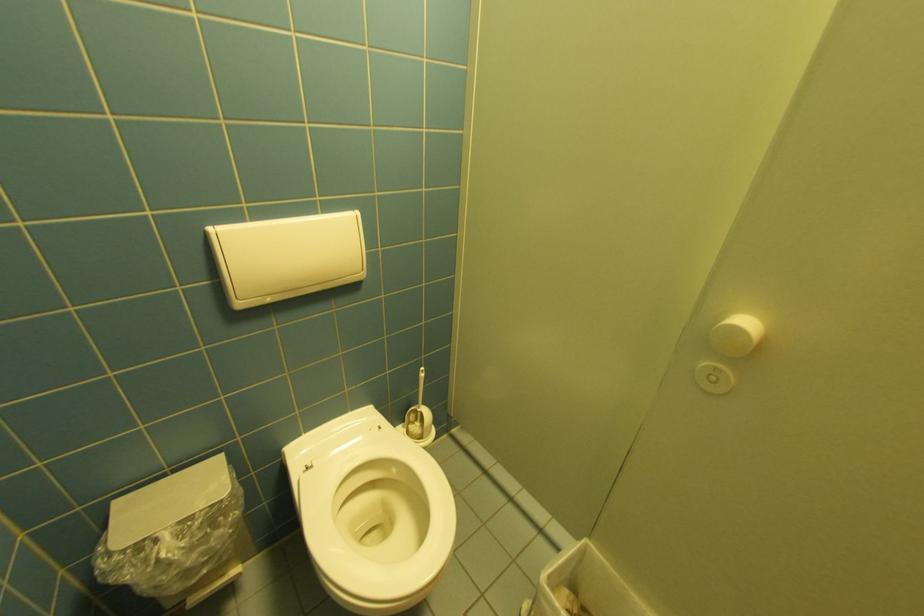
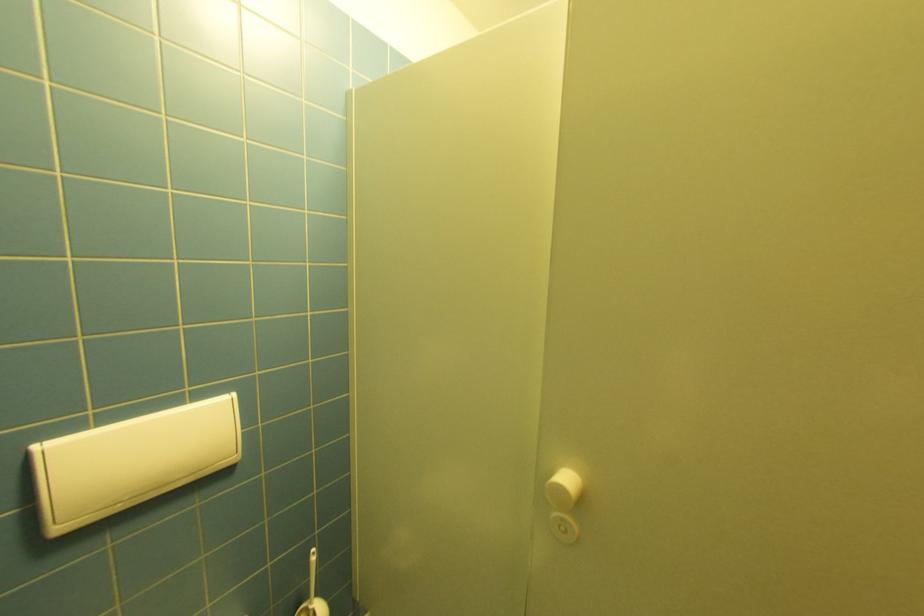
Question: How did the camera likely rotate?

Choices:
 (A) Left
 (B) Right
 (C) Up
 (D) Down

Answer: (C)